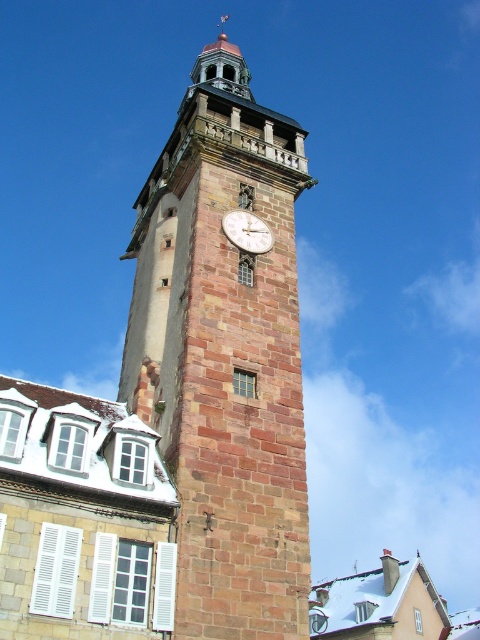
You are an architect reviewing a blueprint of the brown stone clock tower at center and the brick clock at center. Which structure has a larger footprint according to the blueprint?

The brown stone clock tower at center is bigger than brick clock at center, so it has a larger footprint.

You are an architect reviewing a blueprint of a town square. The blueprint shows the brown stone clock tower at center and the brick clock at center. According to the blueprint, which structure is located to the left of the other?

The brown stone clock tower at center is positioned on the left side of brick clock at center, so the brown stone clock tower at center is to the left of the brick clock at center.

You are standing at the base of the clock tower and notice two points marked on the tower. The first point is at coordinates point (274, 349) and the second point is at point (237, 225). Which point is closer to you?

Point (274, 349) is in front of point (237, 225), so the first point is closer to you.